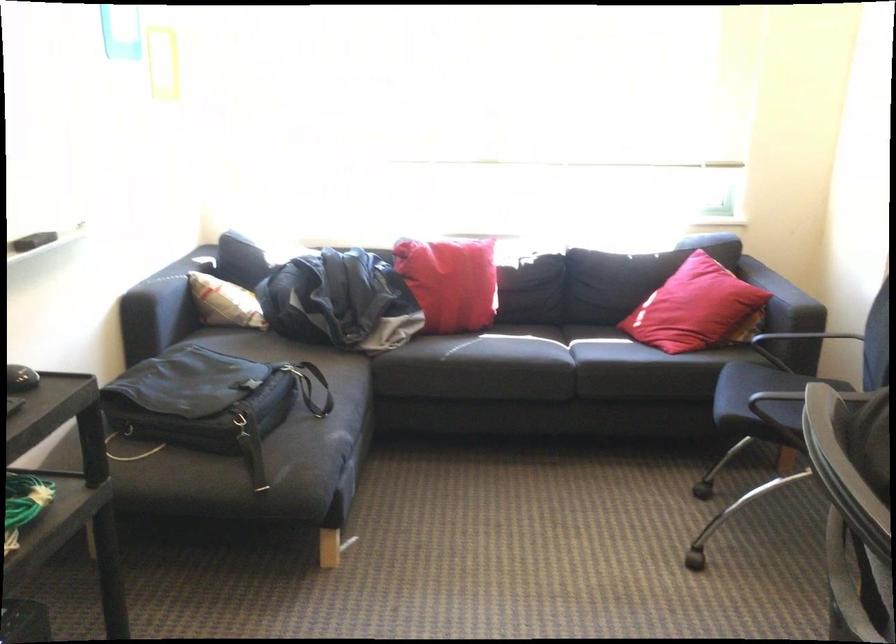
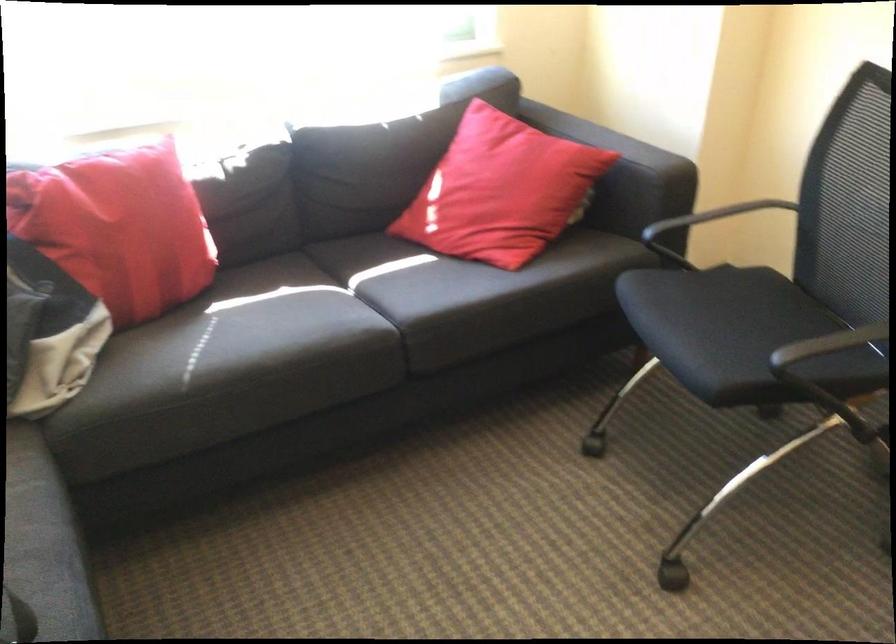
In the second image, find the point that corresponds to point (501, 351) in the first image.

(280, 346)